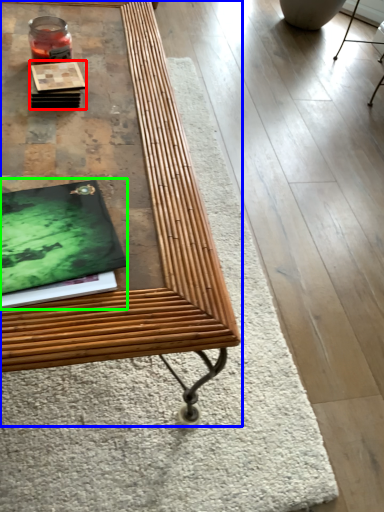
Question: Which object is the closest to the book (highlighted by a red box)? Choose among these: table (highlighted by a blue box) or magazine (highlighted by a green box).

Choices:
 (A) table
 (B) magazine

Answer: (A)